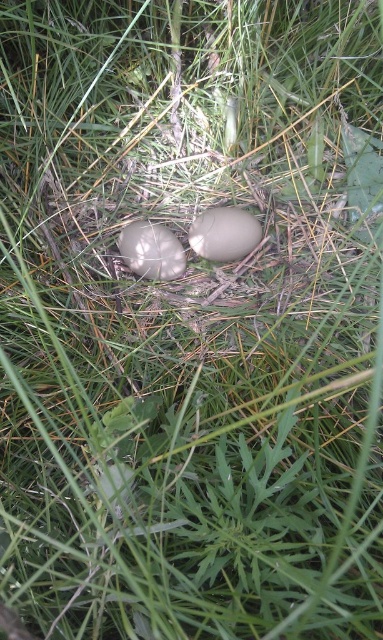
Question: From the image, what is the correct spatial relationship of smooth brown egg at center in relation to smooth beige egg at center?

Choices:
 (A) below
 (B) above

Answer: (B)

Question: Among these objects, which one is farthest from the camera?

Choices:
 (A) smooth brown egg at center
 (B) smooth beige egg at center

Answer: (A)

Question: From the image, what is the correct spatial relationship of smooth brown egg at center in relation to smooth beige egg at center?

Choices:
 (A) left
 (B) right

Answer: (B)

Question: Which point is farther to the camera?

Choices:
 (A) (176, 266)
 (B) (224, 220)

Answer: (A)

Question: Considering the relative positions of smooth brown egg at center and smooth beige egg at center in the image provided, where is smooth brown egg at center located with respect to smooth beige egg at center?

Choices:
 (A) below
 (B) above

Answer: (B)